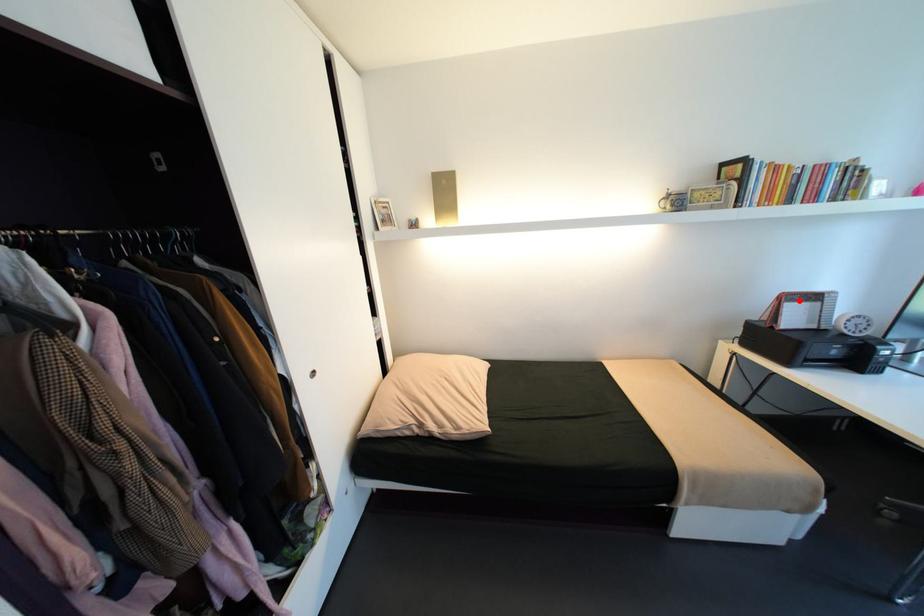
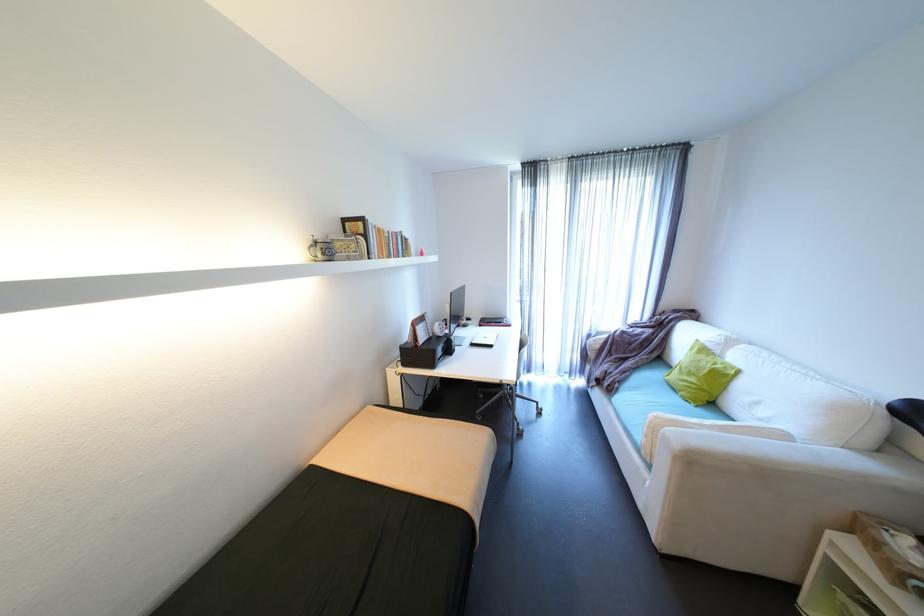
Where in the second image is the point corresponding to the highlighted location from the first image?

(426, 323)